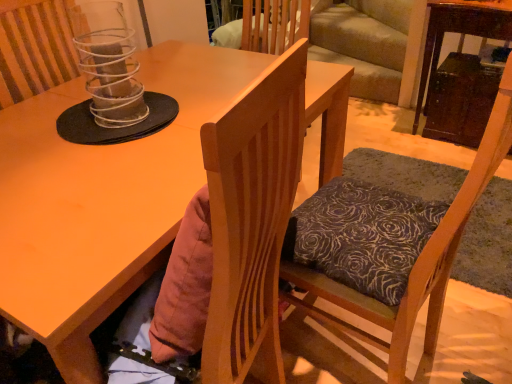
This screenshot has width=512, height=384. Identify the location of free point to the left of clear plastic spiral at upper center. (37, 122).